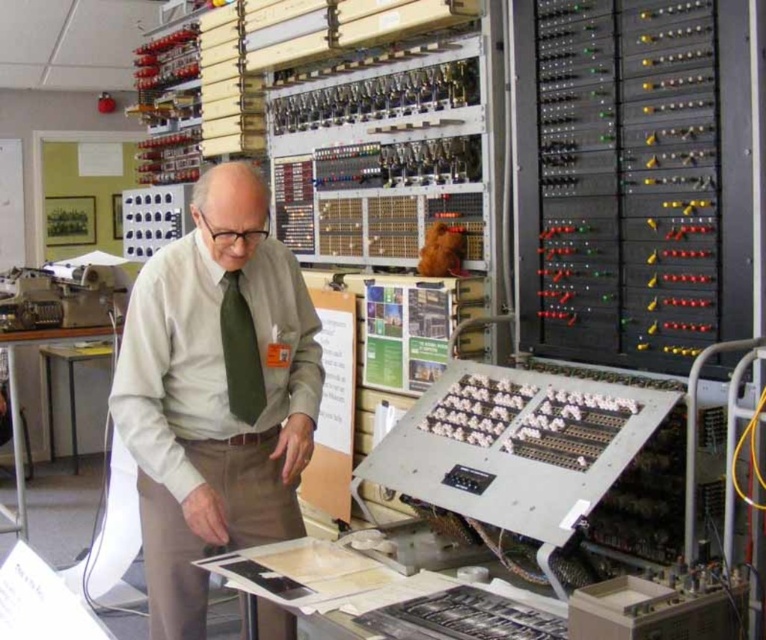
You are an observer looking at the man in the technical setting. Which item is located below the other between the light beige shirt at center and the green silk tie at center?

The light beige shirt at center is positioned under the green silk tie at center, meaning the shirt is below the tie.

You are an engineer analyzing the layout of the laboratory. The coordinates of the light beige shirt at center are given as point A. Where would you place point B to ensure it is directly to the right of point A by 0.1 units in the x direction?

To place point B directly to the right of point A by 0.1 units in the x direction, the coordinates would be calculated by adding 0.1 to the x value of point A. The original coordinates of point A are 0.616 in the x direction and 0.282 in the y direction. Adding 0.1 to the x coordinate gives 0.716, so point B should be placed at coordinates 0.716 in the x and 0.282 in the y direction.